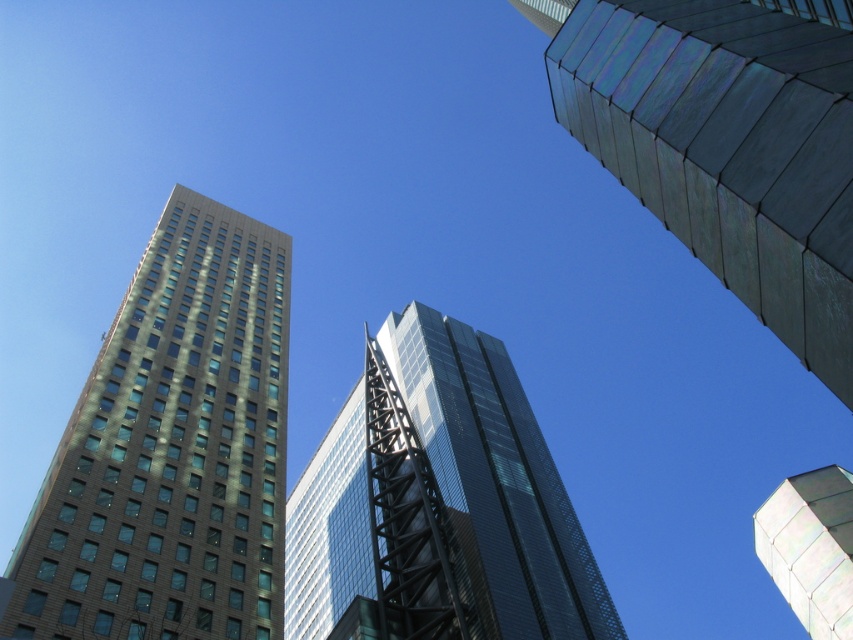
Which of these two, brown brick building at left or metallic silver tower at upper right, stands shorter?

Standing shorter between the two is metallic silver tower at upper right.

Does brown brick building at left appear over metallic silver tower at upper right?

Yes.

Is point (279, 630) less distant than point (849, 611)?

That is False.

At what (x,y) coordinates should I click in order to perform the action: click on brown brick building at left. Please return your answer as a coordinate pair (x, y). The width and height of the screenshot is (853, 640). Looking at the image, I should click on (171, 451).

Who is higher up, brown brick building at left or glassy reflective skyscraper at center?

brown brick building at left is higher up.

Does point (227, 305) come farther from viewer compared to point (543, 548)?

Yes.

I want to click on brown brick building at left, so click(171, 451).

Is glassy reflective skyscraper at center positioned before metallic silver tower at upper right?

No, glassy reflective skyscraper at center is behind metallic silver tower at upper right.

Who is taller, glassy reflective skyscraper at center or metallic silver tower at upper right?

With more height is glassy reflective skyscraper at center.

Who is more distant from viewer, (460, 336) or (805, 627)?

Point (460, 336)

Locate an element on the screen. glassy reflective skyscraper at center is located at coordinates (496, 483).